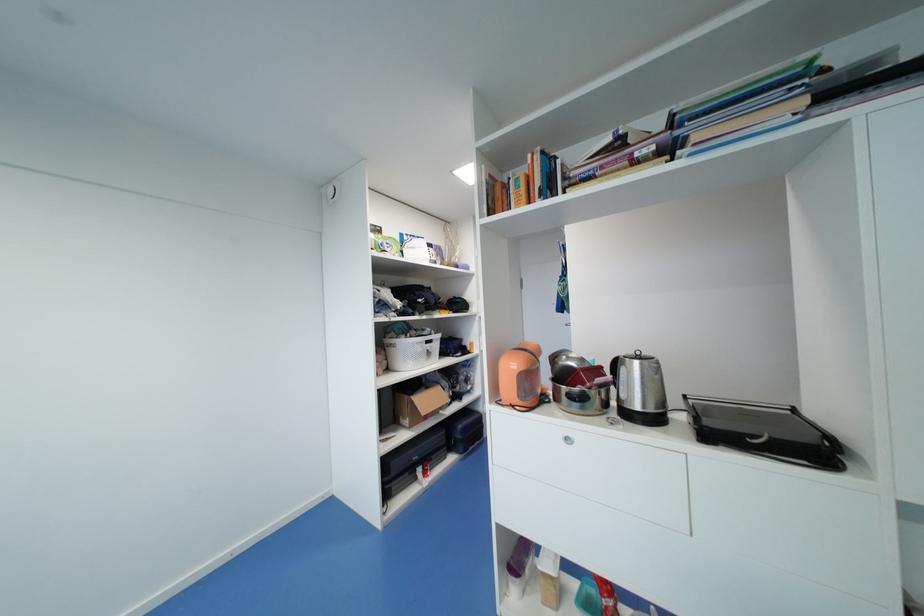
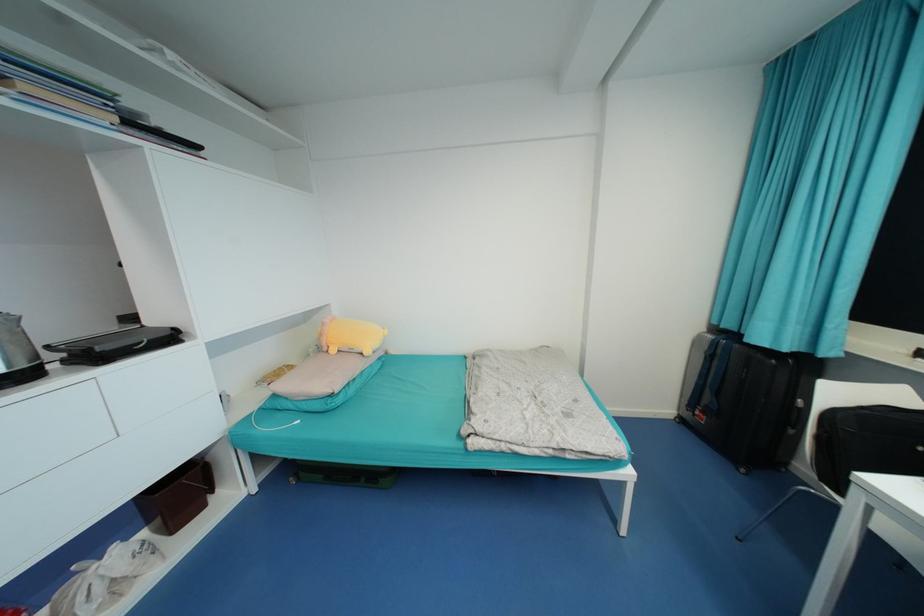
Find the pixel in the second image that matches pixel 655 411 in the first image.

(30, 367)